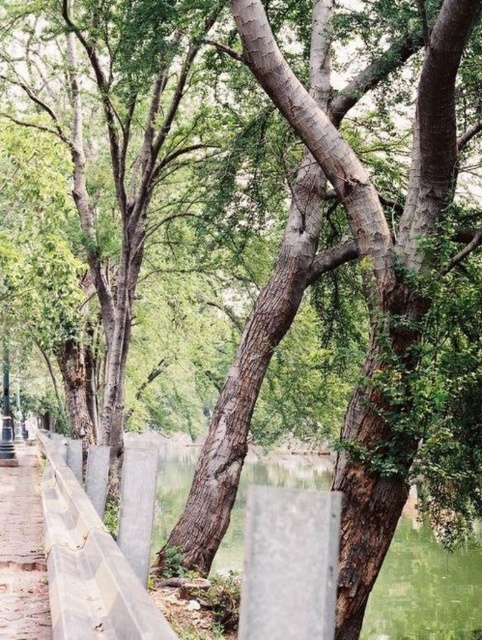
Looking at this image, between green water at center and brown stone pavement at lower left, which one is positioned lower?

green water at center is lower down.

Does green water at center have a greater width compared to brown stone pavement at lower left?

Yes, green water at center is wider than brown stone pavement at lower left.

Is point (162, 540) positioned before point (10, 595)?

No, it is not.

Identify the location of green water at center. (426, 588).